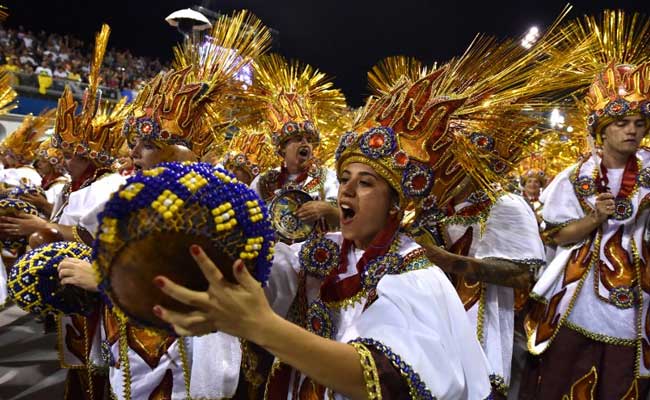
Locate an element on the screen. The width and height of the screenshot is (650, 400). fancy baskets is located at coordinates (179, 185), (47, 273).